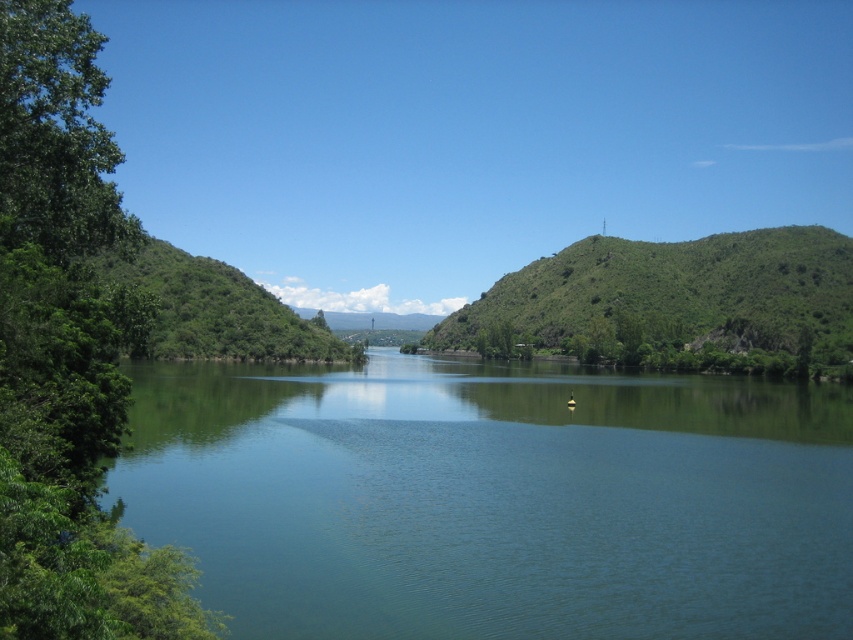
Question: Is green leafy tree at left smaller than green leafy hill at center?

Choices:
 (A) yes
 (B) no

Answer: (A)

Question: Does green smooth water at center appear under green leafy tree at left?

Choices:
 (A) no
 (B) yes

Answer: (B)

Question: Can you confirm if green smooth water at center is thinner than green leafy hill at center?

Choices:
 (A) no
 (B) yes

Answer: (B)

Question: Which point appears closest to the camera in this image?

Choices:
 (A) (99, 284)
 (B) (802, 292)

Answer: (A)

Question: Which point is farther to the camera?

Choices:
 (A) green leafy tree at left
 (B) green leafy hill at center
 (C) green smooth water at center

Answer: (B)

Question: Which point appears farthest from the camera in this image?

Choices:
 (A) (724, 333)
 (B) (115, 419)
 (C) (223, 589)

Answer: (A)